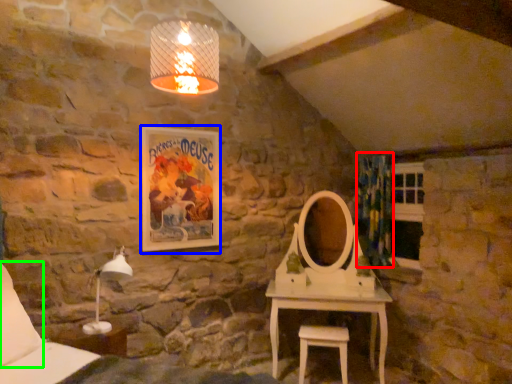
Question: Which object is positioned farthest from curtain (highlighted by a red box)? Select from picture frame (highlighted by a blue box) and pillow (highlighted by a green box).

Choices:
 (A) picture frame
 (B) pillow

Answer: (B)